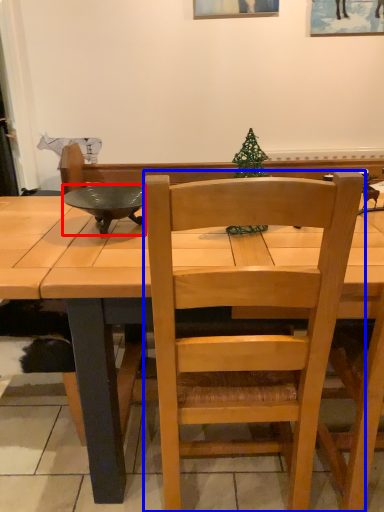
Question: Which object appears farthest to the camera in this image, bowl (highlighted by a red box) or chair (highlighted by a blue box)?

Choices:
 (A) bowl
 (B) chair

Answer: (A)